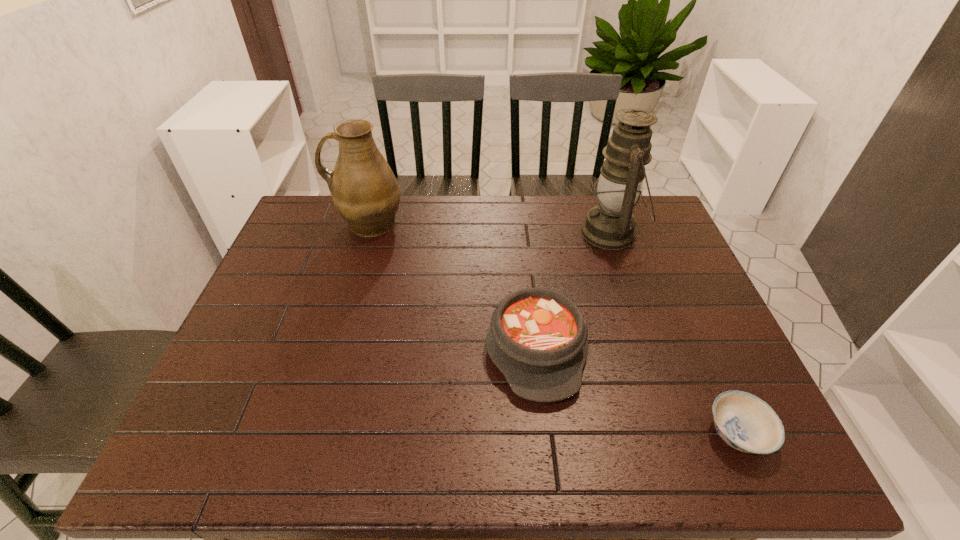
In the image, there is a desktop. Where is `free region at the near edge`? This screenshot has width=960, height=540. free region at the near edge is located at coordinates (528, 447).

This screenshot has height=540, width=960. I want to click on free location at the left edge of the desktop, so click(x=310, y=258).

You are a GUI agent. You are given a task and a screenshot of the screen. Output one action in this format:
    pyautogui.click(x=<x>, y=<y>)
    Task: Click on the free space at the right edge of the desktop
    The width and height of the screenshot is (960, 540).
    Given the screenshot: What is the action you would take?
    pyautogui.click(x=672, y=288)

I want to click on free location at the far left corner, so click(308, 220).

This screenshot has width=960, height=540. In the image, there is a desktop. Identify the location of vacant space at the near right corner. (745, 464).

Identify the location of empty location between the second object from left to right and the third shortest object. (452, 285).

This screenshot has width=960, height=540. In order to click on vacant area that lies between the pitcher and the second shortest object in this screenshot , I will do `click(452, 285)`.

The height and width of the screenshot is (540, 960). I want to click on free spot between the leftmost object and the oil lamp, so click(490, 228).

Image resolution: width=960 pixels, height=540 pixels. Find the location of `vacant point located between the casserole and the pitcher`. vacant point located between the casserole and the pitcher is located at coordinates (452, 285).

What are the coordinates of `free space that is in between the oil lamp and the second shortest object` in the screenshot? It's located at point(573,291).